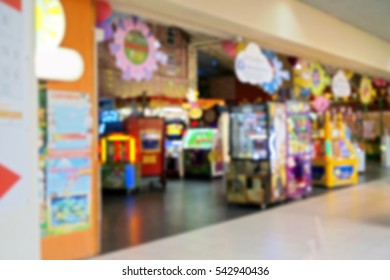
You are a GUI agent. You are given a task and a screenshot of the screen. Output one action in this format:
    pyautogui.click(x=<x>, y=<y>)
    Task: Click on the white tile
    The width and height of the screenshot is (390, 280).
    Given the screenshot: What is the action you would take?
    pyautogui.click(x=286, y=243)